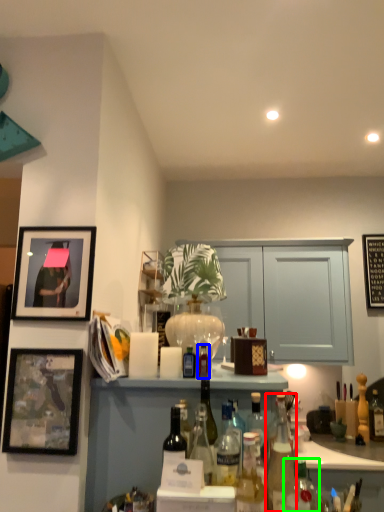
Question: Based on their relative distances, which object is nearer to bottle (highlighted by a red box)? Choose from bottle (highlighted by a blue box) and bottle (highlighted by a green box).

Choices:
 (A) bottle
 (B) bottle

Answer: (B)